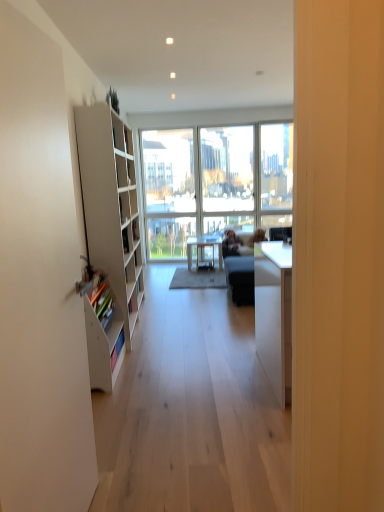
Question: Would you say light brown leather couch at center is outside white matte screen door at left?

Choices:
 (A) yes
 (B) no

Answer: (A)

Question: Are light brown leather couch at center and white matte screen door at left making contact?

Choices:
 (A) no
 (B) yes

Answer: (A)

Question: Is light brown leather couch at center smaller than white matte screen door at left?

Choices:
 (A) yes
 (B) no

Answer: (A)

Question: Is the position of light brown leather couch at center more distant than that of white matte screen door at left?

Choices:
 (A) yes
 (B) no

Answer: (A)

Question: Is light brown leather couch at center at the left side of white matte screen door at left?

Choices:
 (A) yes
 (B) no

Answer: (B)

Question: Is light brown leather couch at center positioned in front of white matte screen door at left?

Choices:
 (A) yes
 (B) no

Answer: (B)

Question: From the image's perspective, is white matte cabinet at left under white matte bookshelf at left?

Choices:
 (A) yes
 (B) no

Answer: (B)

Question: Is white matte cabinet at left bigger than white matte bookshelf at left?

Choices:
 (A) yes
 (B) no

Answer: (A)

Question: Considering the relative positions of white matte cabinet at left and white matte bookshelf at left in the image provided, is white matte cabinet at left to the left of white matte bookshelf at left from the viewer's perspective?

Choices:
 (A) no
 (B) yes

Answer: (B)

Question: From a real-world perspective, does white matte cabinet at left sit lower than white matte bookshelf at left?

Choices:
 (A) yes
 (B) no

Answer: (B)

Question: Considering the relative sizes of white matte cabinet at left and white matte bookshelf at left in the image provided, is white matte cabinet at left thinner than white matte bookshelf at left?

Choices:
 (A) yes
 (B) no

Answer: (B)

Question: Would you say white matte bookshelf at left is part of white matte cabinet at left's contents?

Choices:
 (A) yes
 (B) no

Answer: (B)

Question: Is matte white table at center bigger than white matte bookshelf at left?

Choices:
 (A) yes
 (B) no

Answer: (B)